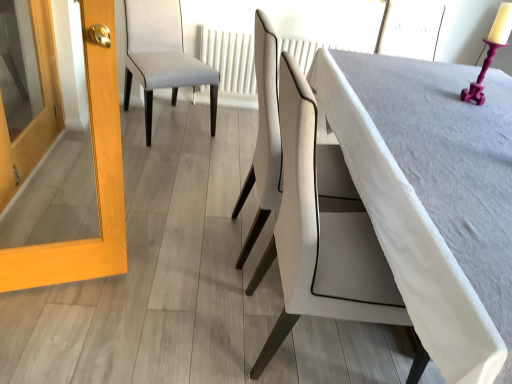
Question: Considering the relative sizes of smooth gray table at center and white leather chair at center, the second chair when ordered from back to front, in the image provided, is smooth gray table at center smaller than white leather chair at center, the second chair when ordered from back to front,?

Choices:
 (A) no
 (B) yes

Answer: (A)

Question: Is white leather chair at center, which is the first chair from right to left, a part of smooth gray table at center?

Choices:
 (A) yes
 (B) no

Answer: (B)

Question: Is the position of smooth gray table at center more distant than that of white leather chair at center, which is the first chair in front-to-back order?

Choices:
 (A) yes
 (B) no

Answer: (B)

Question: Is the surface of smooth gray table at center in direct contact with white leather chair at center, the 2th chair in the left-to-right sequence?

Choices:
 (A) no
 (B) yes

Answer: (A)

Question: From a real-world perspective, is smooth gray table at center located beneath white leather chair at center, the 2th chair in the left-to-right sequence?

Choices:
 (A) no
 (B) yes

Answer: (B)

Question: Does smooth gray table at center have a greater width compared to white leather chair at center, which is the first chair from right to left?

Choices:
 (A) no
 (B) yes

Answer: (B)

Question: Is light gray fabric chair at upper left, which is the first chair in left-to-right order, in front of white leather chair at center, the 2th chair in the left-to-right sequence?

Choices:
 (A) no
 (B) yes

Answer: (A)

Question: Is light gray fabric chair at upper left, the 1th chair viewed from the back, to the right of white leather chair at center, the second chair when ordered from back to front, from the viewer's perspective?

Choices:
 (A) no
 (B) yes

Answer: (A)

Question: Is white leather chair at center, which is the first chair from right to left, a part of light gray fabric chair at upper left, which appears as the second chair when viewed from the front?

Choices:
 (A) yes
 (B) no

Answer: (B)

Question: From a real-world perspective, is light gray fabric chair at upper left, which is the first chair in left-to-right order, under white leather chair at center, the 2th chair in the left-to-right sequence?

Choices:
 (A) no
 (B) yes

Answer: (B)

Question: Is light gray fabric chair at upper left, which is the first chair in left-to-right order, oriented towards white leather chair at center, the 2th chair in the left-to-right sequence?

Choices:
 (A) yes
 (B) no

Answer: (A)

Question: Does light gray fabric chair at upper left, which is the second chair in right-to-left order, have a lesser width compared to white leather chair at center, which is the first chair in front-to-back order?

Choices:
 (A) yes
 (B) no

Answer: (B)

Question: Does smooth gray table at center have a lesser height compared to white textured radiator at center?

Choices:
 (A) yes
 (B) no

Answer: (B)